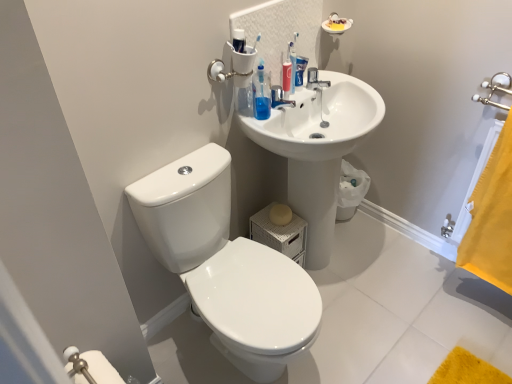
Question: Is metallic silver faucet at upper center taller than white glossy sink at upper right?

Choices:
 (A) yes
 (B) no

Answer: (B)

Question: Would you say metallic silver faucet at upper center contains white glossy sink at upper right?

Choices:
 (A) yes
 (B) no

Answer: (B)

Question: Is metallic silver faucet at upper center not inside white glossy sink at upper right?

Choices:
 (A) no
 (B) yes

Answer: (A)

Question: From the image's perspective, is metallic silver faucet at upper center beneath white glossy sink at upper right?

Choices:
 (A) yes
 (B) no

Answer: (B)

Question: Is metallic silver faucet at upper center to the right of white glossy sink at upper right from the viewer's perspective?

Choices:
 (A) yes
 (B) no

Answer: (B)

Question: Can you see metallic silver faucet at upper center touching white glossy sink at upper right?

Choices:
 (A) no
 (B) yes

Answer: (A)

Question: Does yellow fabric towel at right have a greater width compared to blue matte toothpaste tube at upper center?

Choices:
 (A) yes
 (B) no

Answer: (A)

Question: Is the position of yellow fabric towel at right less distant than that of blue matte toothpaste tube at upper center?

Choices:
 (A) no
 (B) yes

Answer: (B)

Question: Considering the relative positions of yellow fabric towel at right and blue matte toothpaste tube at upper center in the image provided, is yellow fabric towel at right to the right of blue matte toothpaste tube at upper center from the viewer's perspective?

Choices:
 (A) yes
 (B) no

Answer: (A)

Question: Does yellow fabric towel at right have a lesser width compared to blue matte toothpaste tube at upper center?

Choices:
 (A) yes
 (B) no

Answer: (B)

Question: From a real-world perspective, is yellow fabric towel at right over blue matte toothpaste tube at upper center?

Choices:
 (A) no
 (B) yes

Answer: (A)

Question: Can you confirm if yellow fabric towel at right is positioned to the left of blue matte toothpaste tube at upper center?

Choices:
 (A) no
 (B) yes

Answer: (A)

Question: Is white glossy toilet at lower left taller than white glossy sink at upper right?

Choices:
 (A) yes
 (B) no

Answer: (B)